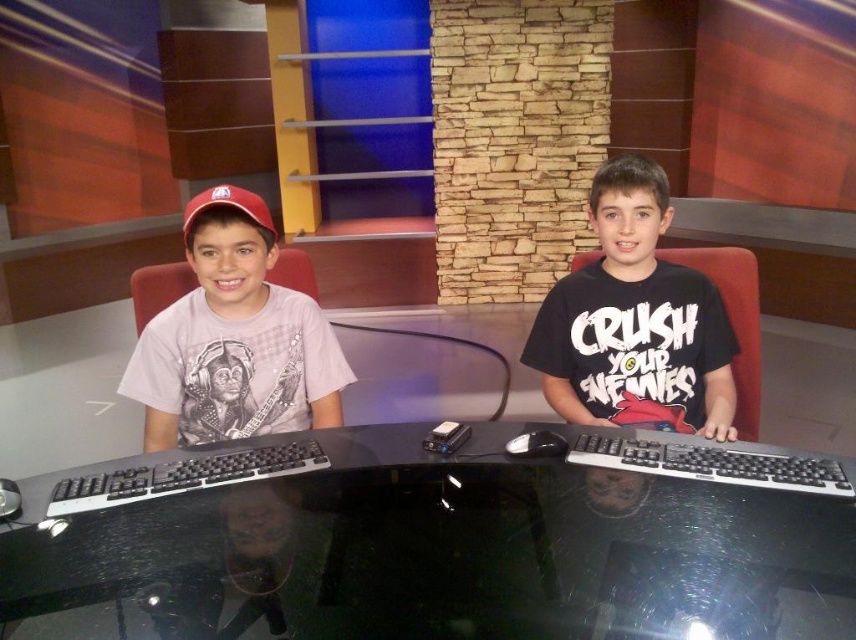
You are a camera operator trying to focus on both points in the image. Which point is closer to the camera, point (x=119, y=390) or point (x=268, y=225)?

Point (x=119, y=390) is closer to the camera than point (x=268, y=225) because it is further to the viewer according to the description.